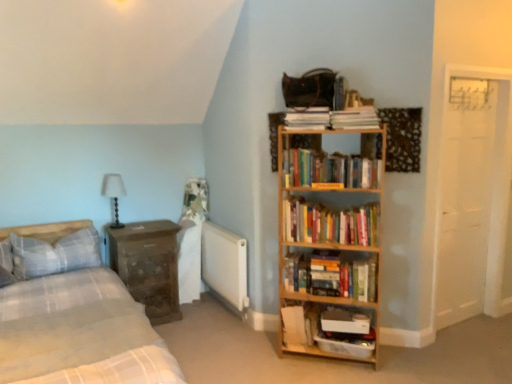
Question: Is white plastic container at lower center, the 1th shelf in the bottom-to-top sequence, smaller than white matte radiator at center?

Choices:
 (A) yes
 (B) no

Answer: (A)

Question: Is white plastic container at lower center, the second shelf in the top-to-bottom sequence, outside of white matte radiator at center?

Choices:
 (A) yes
 (B) no

Answer: (A)

Question: From a real-world perspective, does white plastic container at lower center, the 1th shelf in the bottom-to-top sequence, sit lower than white matte radiator at center?

Choices:
 (A) yes
 (B) no

Answer: (A)

Question: From the image's perspective, does white plastic container at lower center, the second shelf in the top-to-bottom sequence, appear higher than white matte radiator at center?

Choices:
 (A) no
 (B) yes

Answer: (A)

Question: Is white matte radiator at center at the back of white plastic container at lower center, the second shelf in the top-to-bottom sequence?

Choices:
 (A) yes
 (B) no

Answer: (B)

Question: Is white matte radiator at center taller or shorter than hardcover book at center, marked as the first paperback book in a bottom-to-top arrangement?

Choices:
 (A) short
 (B) tall

Answer: (B)

Question: From the image's perspective, relative to hardcover book at center, the 3th paperback book from the top, is white matte radiator at center above or below?

Choices:
 (A) above
 (B) below

Answer: (A)

Question: From a real-world perspective, relative to hardcover book at center, the 3th paperback book from the top, is white matte radiator at center vertically above or below?

Choices:
 (A) above
 (B) below

Answer: (A)

Question: Is point (241, 249) closer or farther from the camera than point (294, 314)?

Choices:
 (A) closer
 (B) farther

Answer: (B)

Question: Based on their positions, is hardcover book at upper center, the 3th paperback book from the bottom, located to the left or right of wooden bookshelf at right, the 1th shelf in the top-to-bottom sequence?

Choices:
 (A) left
 (B) right

Answer: (A)

Question: In the image, is hardcover book at upper center, the 3th paperback book from the bottom, positioned in front of or behind wooden bookshelf at right, the 2th shelf positioned from the bottom?

Choices:
 (A) front
 (B) behind

Answer: (B)

Question: From a real-world perspective, is hardcover book at upper center, the 3th paperback book from the bottom, physically located above or below wooden bookshelf at right, the 1th shelf in the top-to-bottom sequence?

Choices:
 (A) below
 (B) above

Answer: (B)

Question: Is point (313, 119) positioned closer to the camera than point (321, 243)?

Choices:
 (A) farther
 (B) closer

Answer: (B)

Question: Looking at their shapes, would you say white matte radiator at center is wider or thinner than white paper at upper center, the 2th paperback book when ordered from top to bottom?

Choices:
 (A) wide
 (B) thin

Answer: (B)

Question: Is white matte radiator at center in front of or behind white paper at upper center, the second paperback book positioned from the bottom, in the image?

Choices:
 (A) front
 (B) behind

Answer: (B)